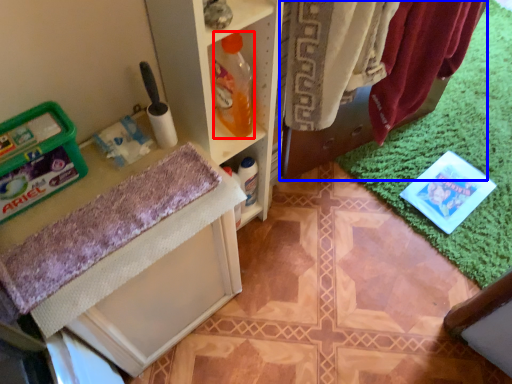
Question: Which object is further to the camera taking this photo, bottle (highlighted by a red box) or laundry (highlighted by a blue box)?

Choices:
 (A) bottle
 (B) laundry

Answer: (A)